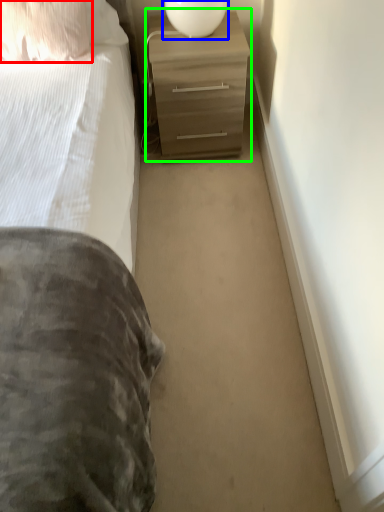
Question: Considering the real-world distances, which object is closest to pillow (highlighted by a red box)? table lamp (highlighted by a blue box) or chest of drawers (highlighted by a green box).

Choices:
 (A) table lamp
 (B) chest of drawers

Answer: (B)